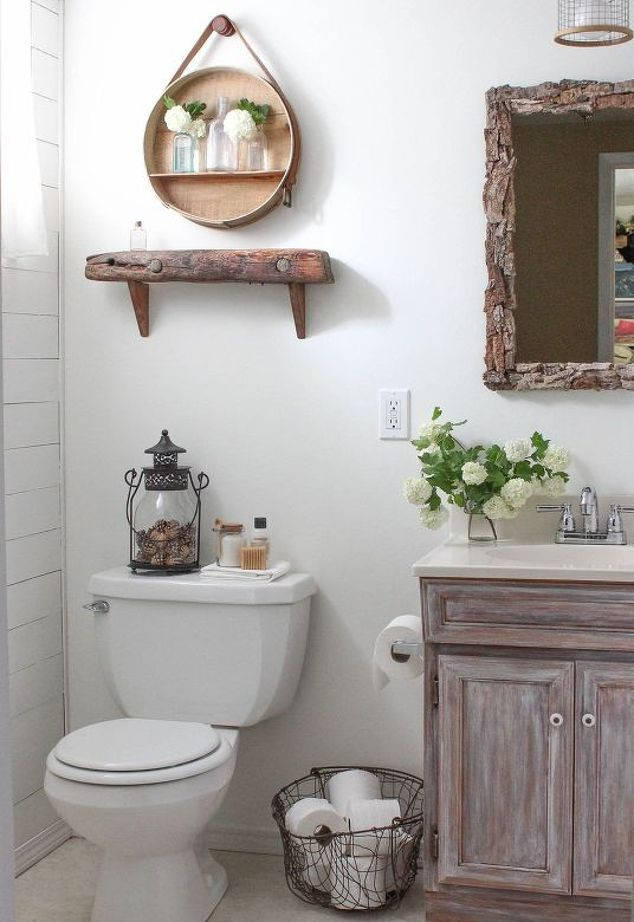
You are a GUI agent. You are given a task and a screenshot of the screen. Output one action in this format:
    pyautogui.click(x=<x>, y=<y>)
    Task: Click on the light coming through window
    
    Given the screenshot: What is the action you would take?
    pyautogui.click(x=18, y=199)